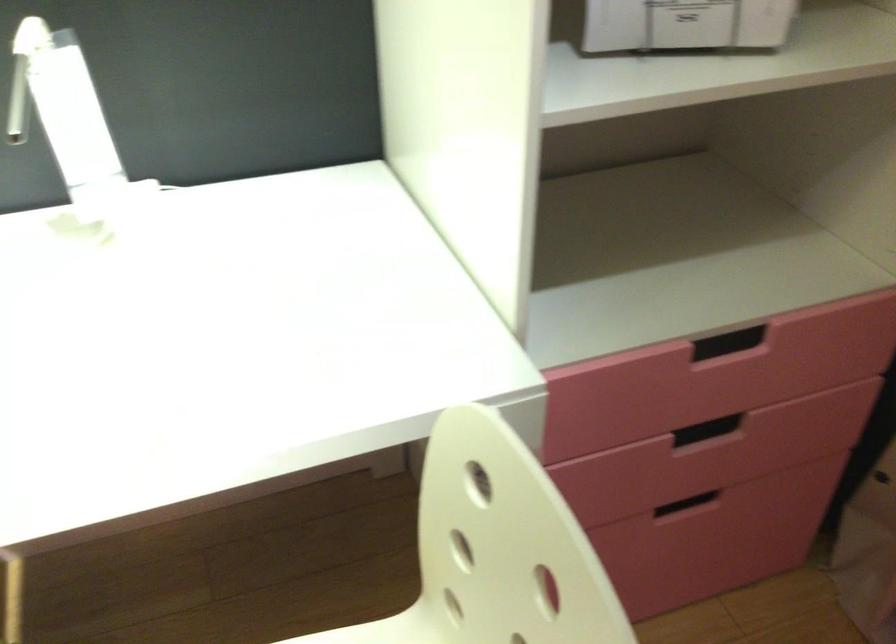
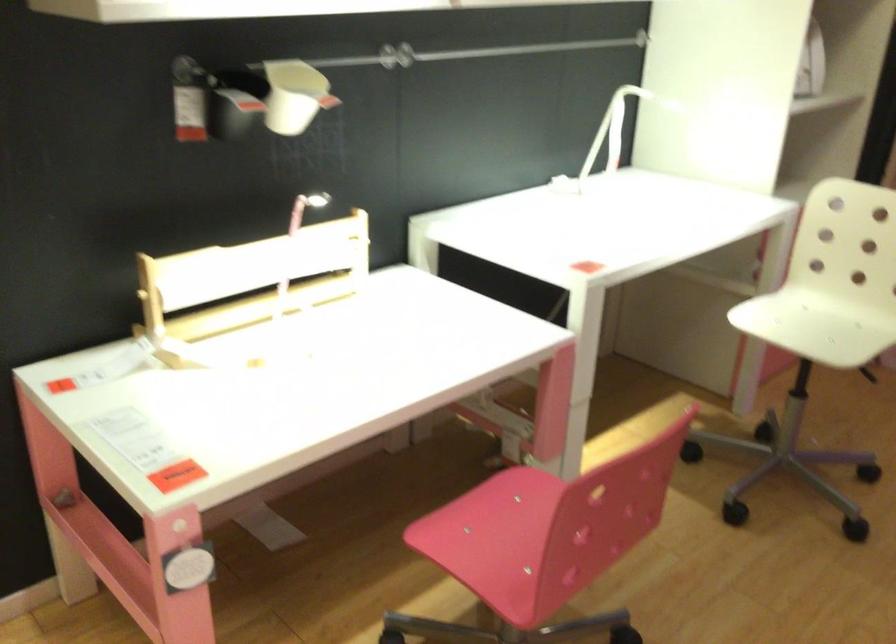
Question: I am providing you with two images of the same scene from different viewpoints. Please identify which objects are invisible in image2.

Choices:
 (A) white wall cup
 (B) black wall container
 (C) recessed drawer handle
 (D) colorful patterned box

Answer: (C)